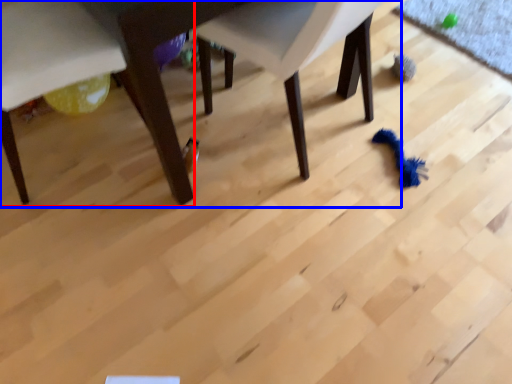
Question: Which object is closer to the camera taking this photo, chair (highlighted by a red box) or table (highlighted by a blue box)?

Choices:
 (A) chair
 (B) table

Answer: (B)